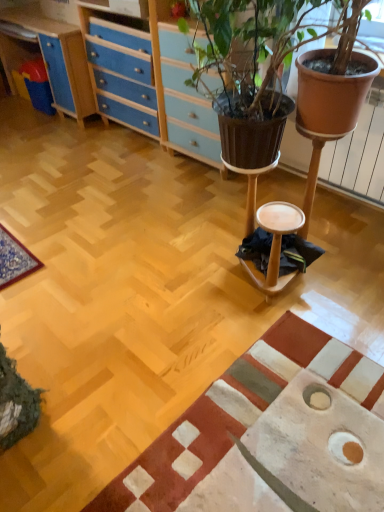
Question: Is the position of wooden stool at center less distant than that of textured beige rug at lower right?

Choices:
 (A) yes
 (B) no

Answer: (B)

Question: From a real-world perspective, is wooden stool at center under textured beige rug at lower right?

Choices:
 (A) yes
 (B) no

Answer: (B)

Question: Is wooden stool at center not close to textured beige rug at lower right?

Choices:
 (A) no
 (B) yes

Answer: (A)

Question: Does wooden stool at center appear on the right side of textured beige rug at lower right?

Choices:
 (A) no
 (B) yes

Answer: (B)

Question: Does wooden stool at center have a lesser width compared to textured beige rug at lower right?

Choices:
 (A) yes
 (B) no

Answer: (A)

Question: Is wooden stool at center smaller than textured beige rug at lower right?

Choices:
 (A) no
 (B) yes

Answer: (B)

Question: Does blue wood/file cabinet at upper left have a smaller size compared to textured beige rug at lower right?

Choices:
 (A) yes
 (B) no

Answer: (B)

Question: Can you confirm if blue wood/file cabinet at upper left is bigger than textured beige rug at lower right?

Choices:
 (A) no
 (B) yes

Answer: (B)

Question: Is blue wood/file cabinet at upper left to the left of textured beige rug at lower right from the viewer's perspective?

Choices:
 (A) no
 (B) yes

Answer: (B)

Question: Can you confirm if blue wood/file cabinet at upper left is shorter than textured beige rug at lower right?

Choices:
 (A) yes
 (B) no

Answer: (B)

Question: From a real-world perspective, is blue wood/file cabinet at upper left positioned over textured beige rug at lower right based on gravity?

Choices:
 (A) no
 (B) yes

Answer: (B)

Question: Is the position of blue wood/file cabinet at upper left less distant than that of textured beige rug at lower right?

Choices:
 (A) yes
 (B) no

Answer: (B)

Question: Is the depth of textured beige rug at lower right less than that of wooden stool at center?

Choices:
 (A) yes
 (B) no

Answer: (A)